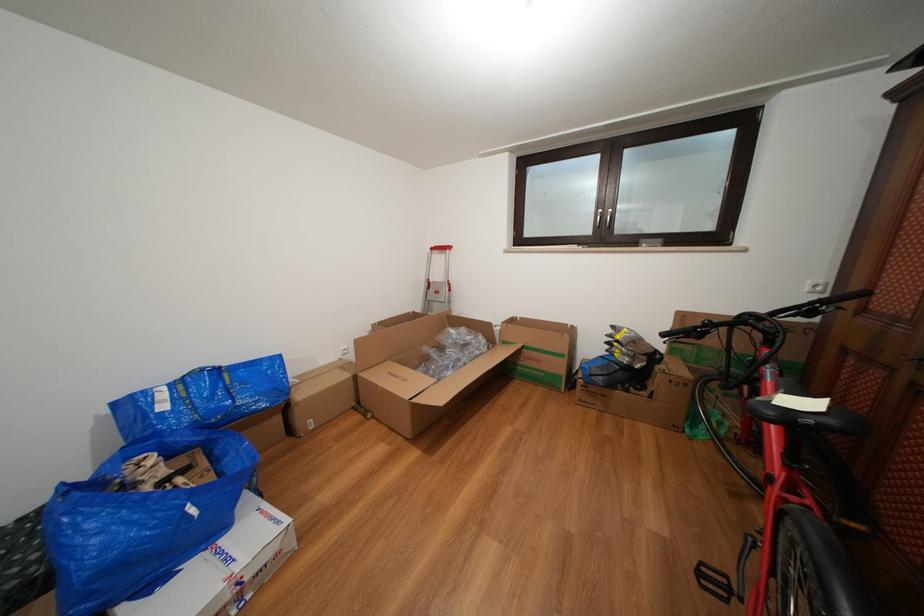
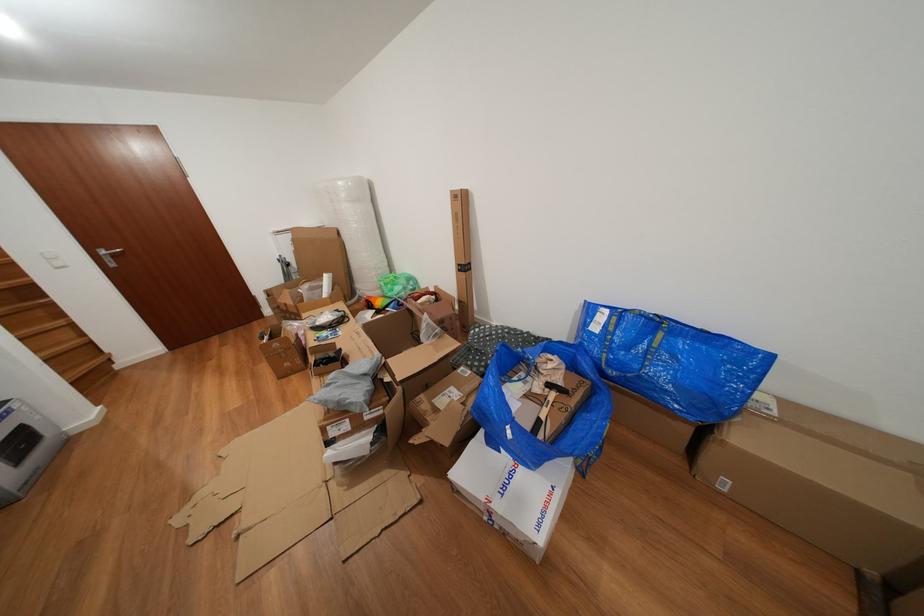
The point at (235, 565) is marked in the first image. Where is the corresponding point in the second image?

(513, 493)